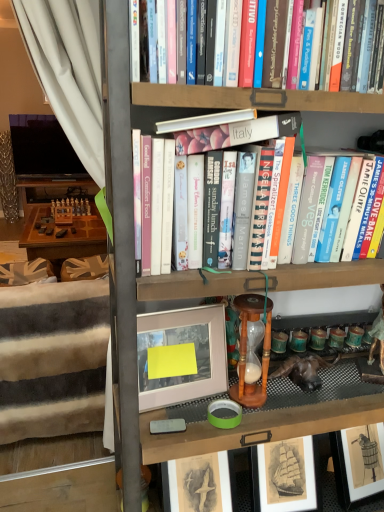
Question: Is wooden hourglass at center wider than wooden bookcase at center?

Choices:
 (A) yes
 (B) no

Answer: (B)

Question: From the image's perspective, is wooden hourglass at center below wooden bookcase at center?

Choices:
 (A) yes
 (B) no

Answer: (B)

Question: Is wooden hourglass at center closer to camera compared to wooden bookcase at center?

Choices:
 (A) no
 (B) yes

Answer: (A)

Question: Is wooden hourglass at center shorter than wooden bookcase at center?

Choices:
 (A) yes
 (B) no

Answer: (A)

Question: Does wooden hourglass at center appear on the left side of wooden bookcase at center?

Choices:
 (A) no
 (B) yes

Answer: (B)

Question: Would you say matte white picture frame at center is to the left or to the right of hardcover books at center in the picture?

Choices:
 (A) right
 (B) left

Answer: (B)

Question: Considering the positions of matte white picture frame at center and hardcover books at center in the image, is matte white picture frame at center taller or shorter than hardcover books at center?

Choices:
 (A) short
 (B) tall

Answer: (A)

Question: From a real-world perspective, relative to hardcover books at center, is matte white picture frame at center vertically above or below?

Choices:
 (A) above
 (B) below

Answer: (B)

Question: Considering their positions, is matte white picture frame at center located in front of or behind hardcover books at center?

Choices:
 (A) front
 (B) behind

Answer: (B)

Question: From the image's perspective, is white fabric bed frame at left above or below hardcover books at center?

Choices:
 (A) below
 (B) above

Answer: (A)

Question: Is white fabric bed frame at left taller or shorter than hardcover books at center?

Choices:
 (A) tall
 (B) short

Answer: (A)

Question: From a real-world perspective, is white fabric bed frame at left positioned above or below hardcover books at center?

Choices:
 (A) above
 (B) below

Answer: (B)

Question: Considering their positions, is white fabric bed frame at left located in front of or behind hardcover books at center?

Choices:
 (A) behind
 (B) front

Answer: (A)

Question: From a real-world perspective, is white fabric bed frame at left above or below wooden hourglass at center?

Choices:
 (A) below
 (B) above

Answer: (A)

Question: In terms of height, does white fabric bed frame at left look taller or shorter compared to wooden hourglass at center?

Choices:
 (A) short
 (B) tall

Answer: (B)